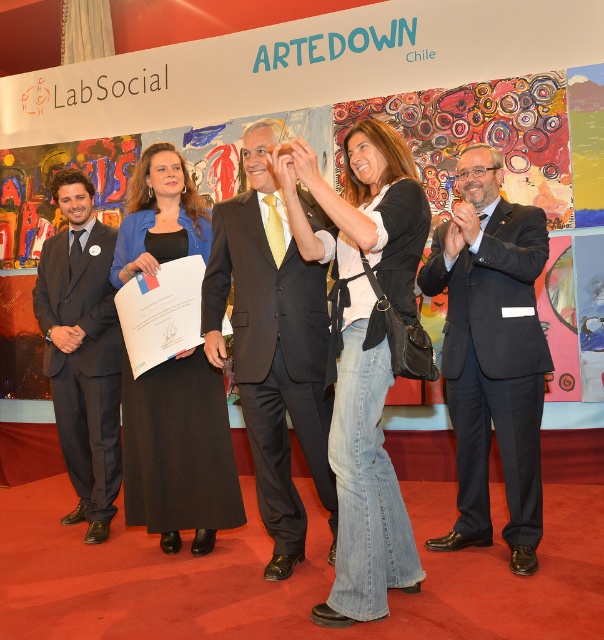
Question: Is jeans at center above matte black suit at center?

Choices:
 (A) no
 (B) yes

Answer: (A)

Question: Estimate the real-world distances between objects in this image. Which object is farther from the matte black suit at left?

Choices:
 (A) black fabric dress at center
 (B) matte black suit at center
 (C) dark blue suit at right

Answer: (C)

Question: Which point appears closest to the camera in this image?

Choices:
 (A) (370, 456)
 (B) (140, 376)
 (C) (109, 353)
 (D) (457, 410)

Answer: (A)

Question: Is jeans at center further to the viewer compared to matte black suit at left?

Choices:
 (A) no
 (B) yes

Answer: (A)

Question: From the image, what is the correct spatial relationship of jeans at center in relation to matte black suit at left?

Choices:
 (A) right
 (B) left

Answer: (A)

Question: Based on their relative distances, which object is farther from the jeans at center?

Choices:
 (A) matte black suit at center
 (B) dark blue suit at right

Answer: (B)